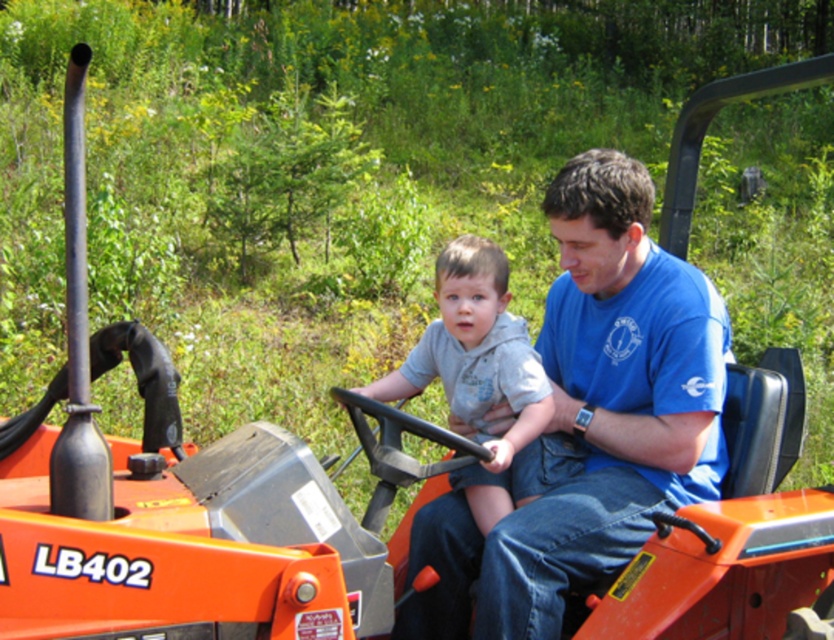
Please provide the coordinates of the blue cotton shirt at center in the image. The answer should be in the format of coordinates enclosed in parentheses, like so.

The blue cotton shirt at center is located at coordinates point (591, 419). So the coordinates are point (591, 419).

You are standing at the point labeled as point (591, 419) in the image. What object is directly in front of you?

The blue cotton shirt at center is directly in front of you at point (591, 419).

You are a photographer trying to capture a clear photo of both the blue cotton shirt at center and the gray soft hoodie at center. Which one should you focus on first to ensure both are in focus?

You should focus on the blue cotton shirt at center first since it is closer to the viewer than the gray soft hoodie at center. By focusing on the closer object, the depth of field may also keep the farther one in focus.